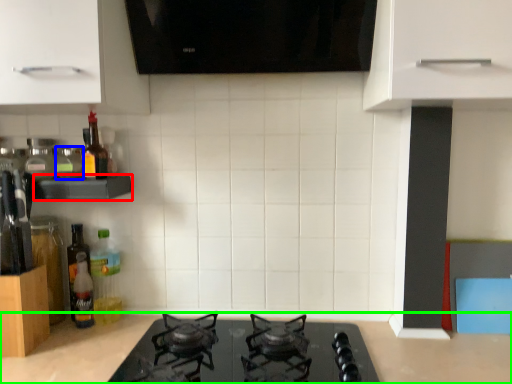
Question: Considering the real-world distances, which object is closest to shelf (highlighted by a red box)? bottle (highlighted by a blue box) or countertop (highlighted by a green box).

Choices:
 (A) bottle
 (B) countertop

Answer: (A)